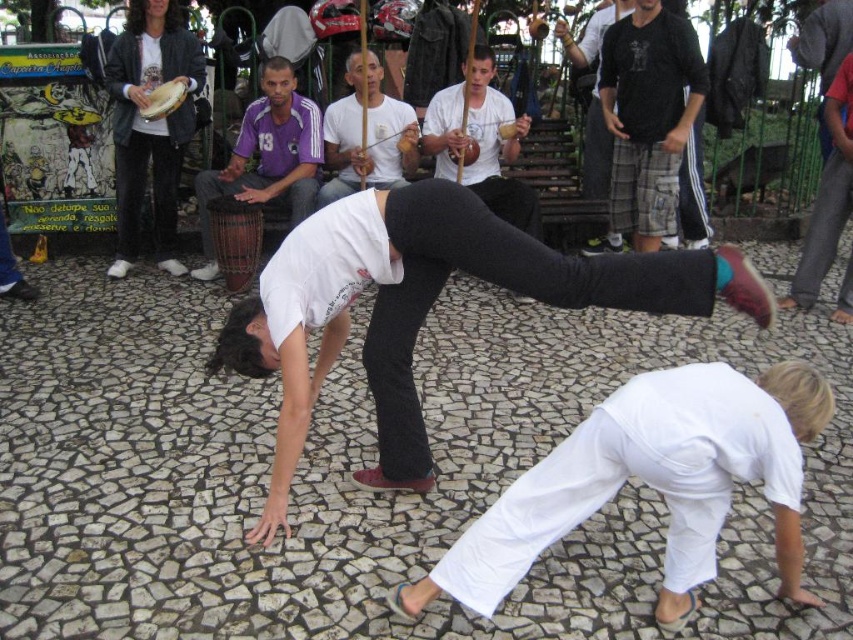
Question: Can you confirm if matte black drum at left is thinner than dark gray plaid shorts at upper right?

Choices:
 (A) no
 (B) yes

Answer: (A)

Question: Which object appears farthest from the camera in this image?

Choices:
 (A) dark gray plaid shorts at upper right
 (B) white cotton shirt at center

Answer: (A)

Question: Which object is positioned farthest from the white cotton shirt at center?

Choices:
 (A) matte black pants at center
 (B) black cotton shirt at upper center
 (C) white matte drum at center
 (D) matte black drum at left

Answer: (A)

Question: Does matte black pants at center have a lesser width compared to white cotton shirt at center?

Choices:
 (A) no
 (B) yes

Answer: (A)

Question: Does white matte drum at center have a smaller size compared to white cotton shirt at center?

Choices:
 (A) yes
 (B) no

Answer: (B)

Question: Which of the following is the closest to the observer?

Choices:
 (A) (113, 81)
 (B) (647, 81)
 (C) (573, 52)
 (D) (252, 184)

Answer: (B)